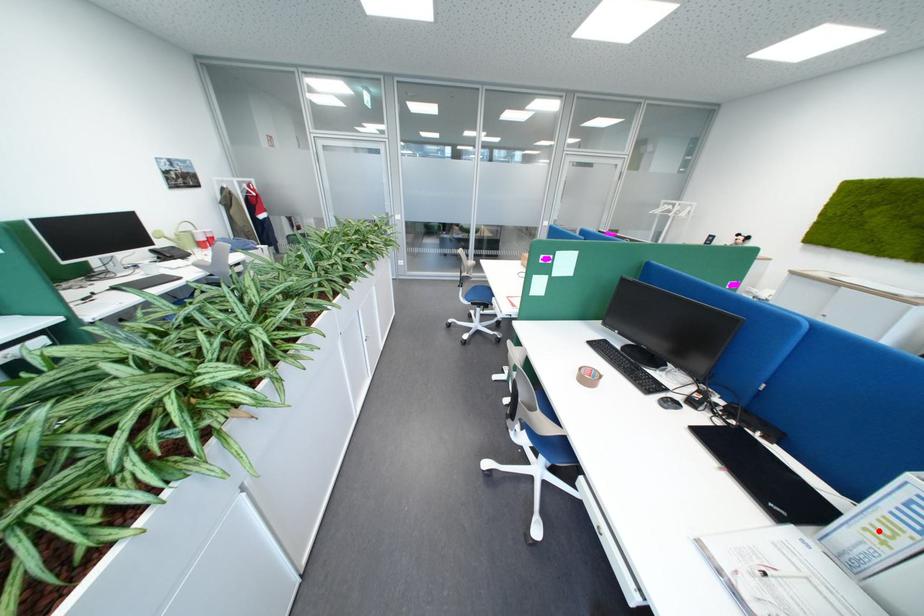
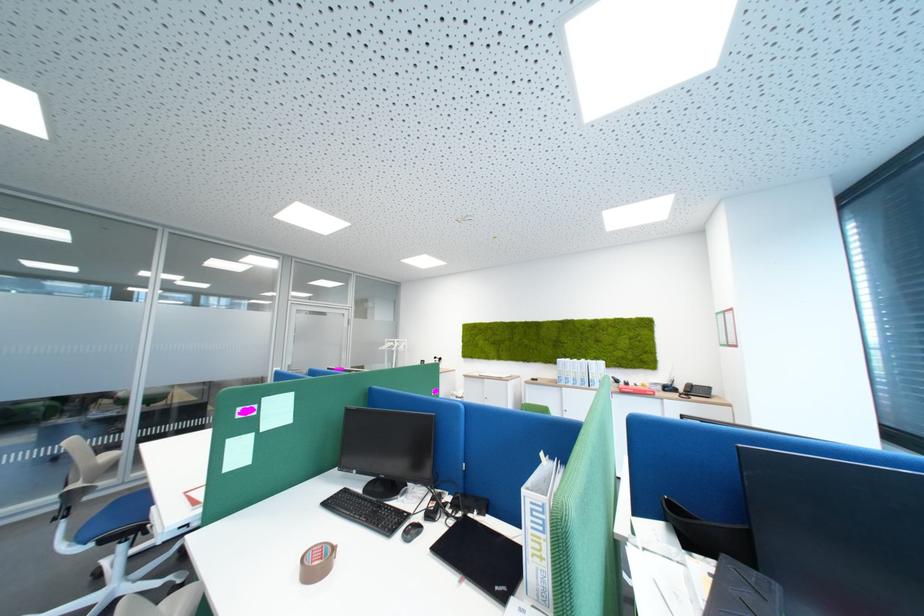
Where in the second image is the point corresponding to the highlighted location from the first image?

(545, 556)